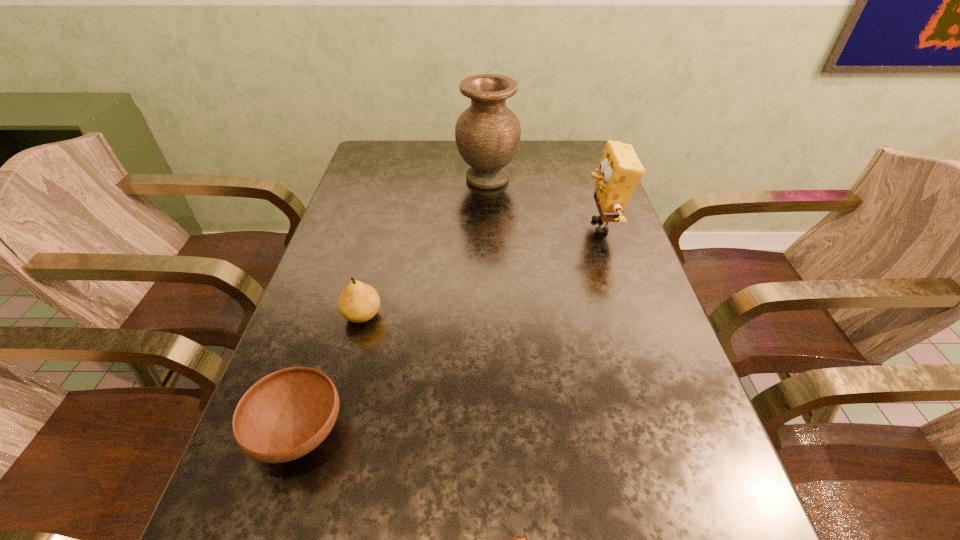
At what (x,y) coordinates should I click in order to perform the action: click on vase. Please return your answer as a coordinate pair (x, y). Looking at the image, I should click on (487, 134).

The image size is (960, 540). Find the location of `the farthest object`. the farthest object is located at coordinates (487, 134).

Where is `the fourth shortest object`? This screenshot has width=960, height=540. the fourth shortest object is located at coordinates (620, 171).

Find the location of a particular element. The height and width of the screenshot is (540, 960). the rightmost object is located at coordinates (620, 171).

The image size is (960, 540). I want to click on the third farthest object, so click(x=359, y=302).

Locate an element on the screen. the third tallest object is located at coordinates (359, 302).

I want to click on bowl, so click(285, 415).

Locate an element on the screen. The height and width of the screenshot is (540, 960). the second shortest object is located at coordinates (285, 415).

Find the location of a particular element. This screenshot has height=540, width=960. vacant space located 0.120m on the left of the farthest object is located at coordinates (419, 179).

The width and height of the screenshot is (960, 540). I want to click on free space located on the face of the fourth nearest object, so click(530, 226).